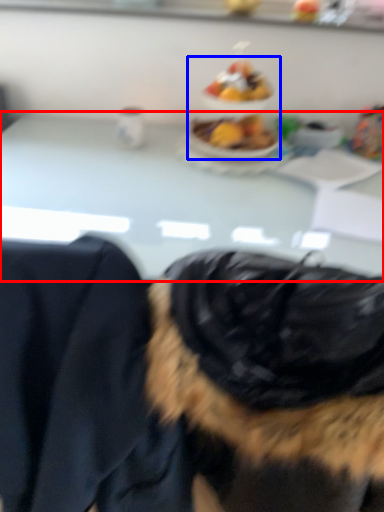
Question: Which point is closer to the camera, table (highlighted by a red box) or food (highlighted by a blue box)?

Choices:
 (A) table
 (B) food

Answer: (A)